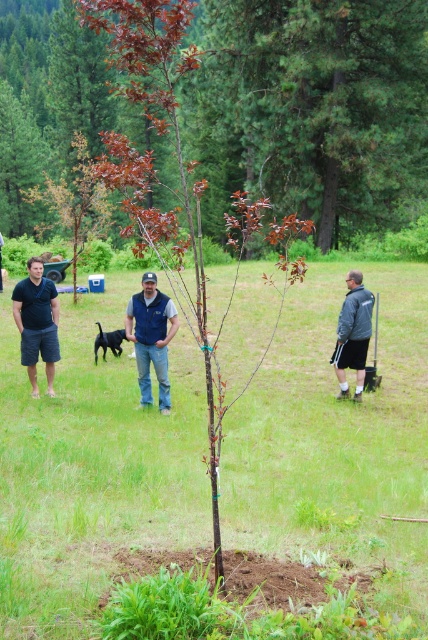
Question: Which object appears farthest from the camera in this image?

Choices:
 (A) smooth brown tree at center
 (B) blue denim jeans at center
 (C) matte black t-shirt at left
 (D) gray fabric jacket at center

Answer: (A)

Question: Is blue denim jeans at center in front of black fur dog at center?

Choices:
 (A) yes
 (B) no

Answer: (A)

Question: From the image, what is the correct spatial relationship of blue denim jeans at center in relation to gray fabric jacket at center?

Choices:
 (A) below
 (B) above

Answer: (A)

Question: Among these objects, which one is farthest from the camera?

Choices:
 (A) black fur dog at center
 (B) blue denim jeans at center
 (C) matte black t-shirt at left

Answer: (A)

Question: Is matte black t-shirt at left wider than black fur dog at center?

Choices:
 (A) yes
 (B) no

Answer: (A)

Question: Which object appears farthest from the camera in this image?

Choices:
 (A) smooth brown tree at center
 (B) blue denim jeans at center
 (C) black fur dog at center
 (D) gray fabric jacket at center

Answer: (A)